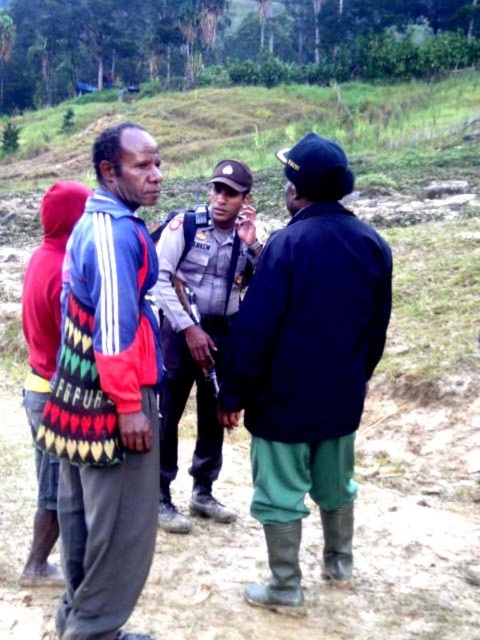
Consider the image. You are a delivery person trying to locate a package that was accidentally left on either the dark blue jacket at center or the knitted fabric bag at center. Based on the scene description, which object is more likely to have the package?

The knitted fabric bag at center is more likely to have the package because the dark blue jacket at center is positioned under it, meaning the bag is above the jacket and could be where the package was placed.

You are planning to set up a temporary tent for an outdoor event. The dirt field at center is located at coordinates 0.755, 0.762. Is this location suitable for setting up the tent?

The dirt field at center is located at coordinates (365, 483). This location is suitable for setting up the tent as it is a flat area in the center of the scene.